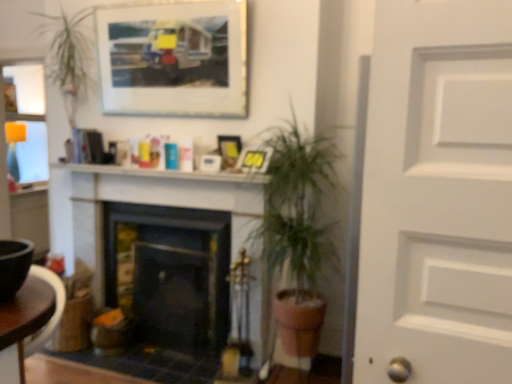
Question: Does green leafy plant at center appear on the right side of white glossy mantel at upper center?

Choices:
 (A) no
 (B) yes

Answer: (B)

Question: From a real-world perspective, is green leafy plant at center positioned under white glossy mantel at upper center based on gravity?

Choices:
 (A) yes
 (B) no

Answer: (A)

Question: From the image's perspective, is green leafy plant at center located beneath white glossy mantel at upper center?

Choices:
 (A) no
 (B) yes

Answer: (B)

Question: Does green leafy plant at center have a lesser height compared to white glossy mantel at upper center?

Choices:
 (A) no
 (B) yes

Answer: (A)

Question: Considering the relative sizes of green leafy plant at center and white glossy mantel at upper center in the image provided, is green leafy plant at center bigger than white glossy mantel at upper center?

Choices:
 (A) no
 (B) yes

Answer: (B)

Question: Does green leafy plant at center appear on the left side of white glossy mantel at upper center?

Choices:
 (A) no
 (B) yes

Answer: (A)

Question: Is brown wooden table at lower left turned away from matte plastic picture frame at upper center, the first picture frame in the bottom-to-top sequence?

Choices:
 (A) yes
 (B) no

Answer: (A)

Question: From a real-world perspective, is brown wooden table at lower left on matte plastic picture frame at upper center, which ranks as the 3th picture frame in top-to-bottom order?

Choices:
 (A) no
 (B) yes

Answer: (A)

Question: From the image's perspective, is brown wooden table at lower left beneath matte plastic picture frame at upper center, the first picture frame in the bottom-to-top sequence?

Choices:
 (A) no
 (B) yes

Answer: (B)

Question: Is matte plastic picture frame at upper center, which ranks as the 3th picture frame in top-to-bottom order, surrounded by brown wooden table at lower left?

Choices:
 (A) no
 (B) yes

Answer: (A)

Question: Considering the relative positions of brown wooden table at lower left and matte plastic picture frame at upper center, which ranks as the 3th picture frame in top-to-bottom order, in the image provided, is brown wooden table at lower left to the right of matte plastic picture frame at upper center, which ranks as the 3th picture frame in top-to-bottom order, from the viewer's perspective?

Choices:
 (A) no
 (B) yes

Answer: (A)

Question: Is brown wooden table at lower left in front of matte plastic picture frame at upper center, which ranks as the 3th picture frame in top-to-bottom order?

Choices:
 (A) no
 (B) yes

Answer: (B)

Question: From the image's perspective, is white glossy mantel at upper center on matte plastic picture frame at center, which ranks as the second picture frame in bottom-to-top order?

Choices:
 (A) no
 (B) yes

Answer: (A)